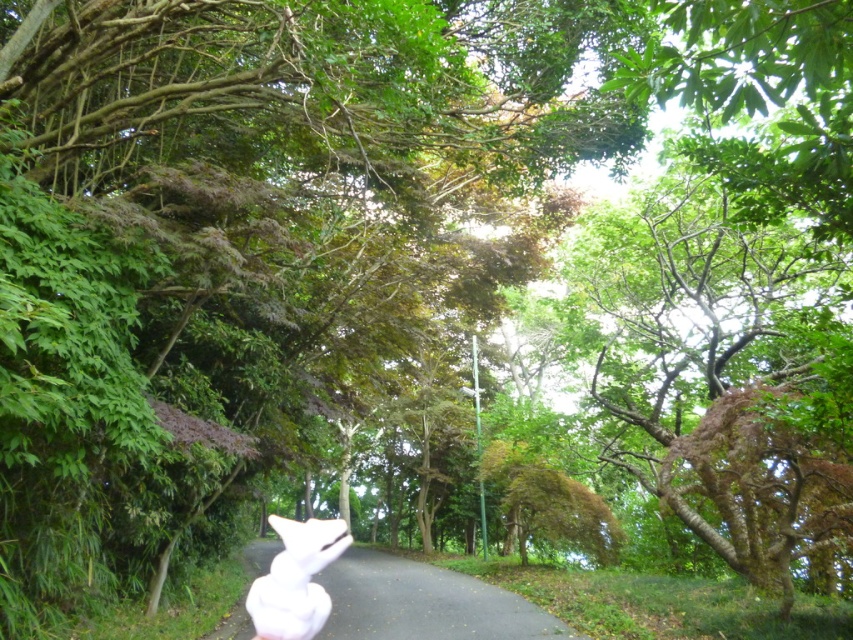
Can you confirm if white fabric at center is positioned above white fluffy bunny at center?

Yes.

How much distance is there between white fabric at center and white fluffy bunny at center?

A distance of 2.23 meters exists between white fabric at center and white fluffy bunny at center.

The image size is (853, 640). What do you see at coordinates (424, 602) in the screenshot? I see `white fabric at center` at bounding box center [424, 602].

What are the coordinates of `white fabric at center` in the screenshot? It's located at (424, 602).